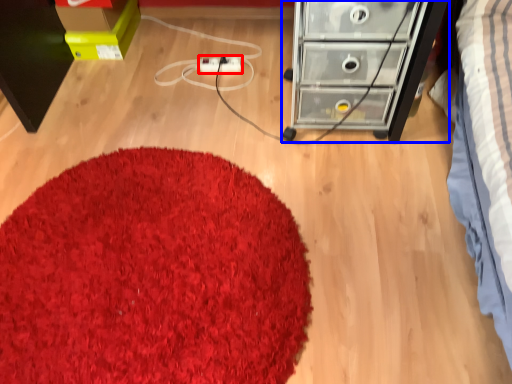
Question: Which point is closer to the camera, extension cord (highlighted by a red box) or chest of drawers (highlighted by a blue box)?

Choices:
 (A) extension cord
 (B) chest of drawers

Answer: (B)